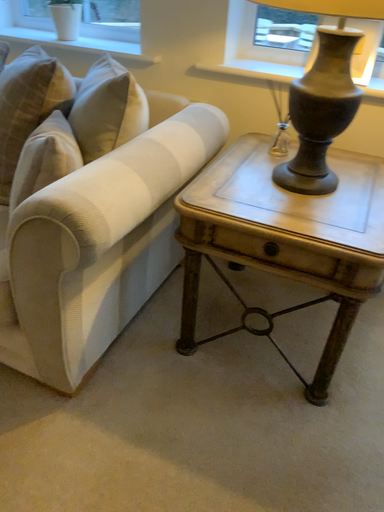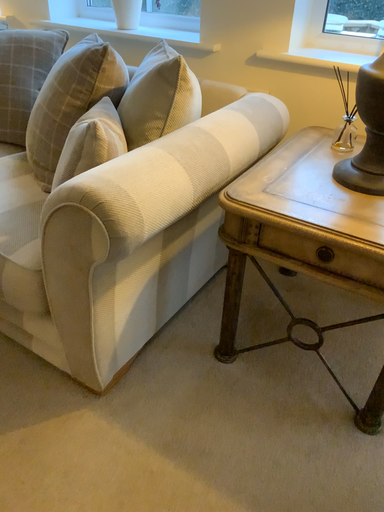
Question: How did the camera likely rotate when shooting the video?

Choices:
 (A) rotated right
 (B) rotated left

Answer: (B)